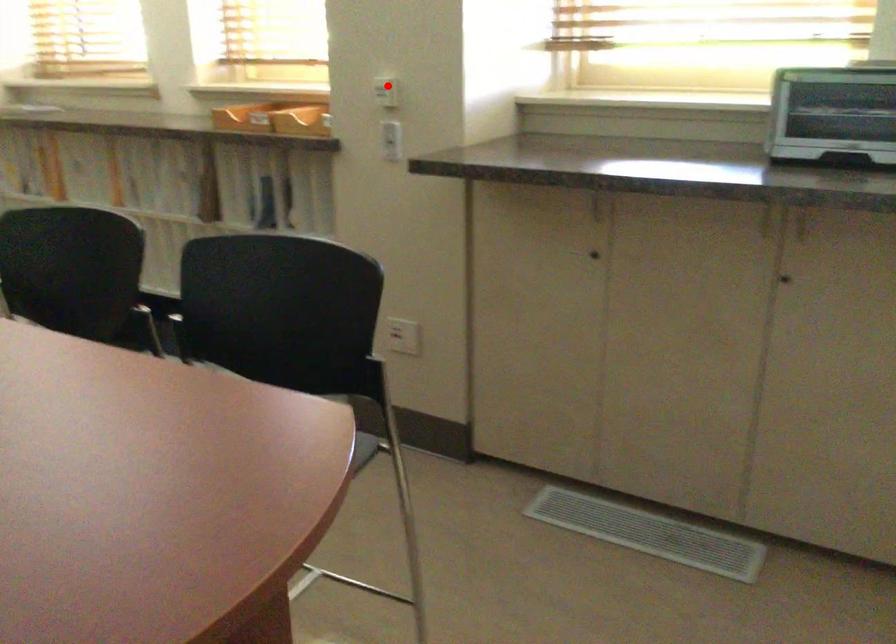
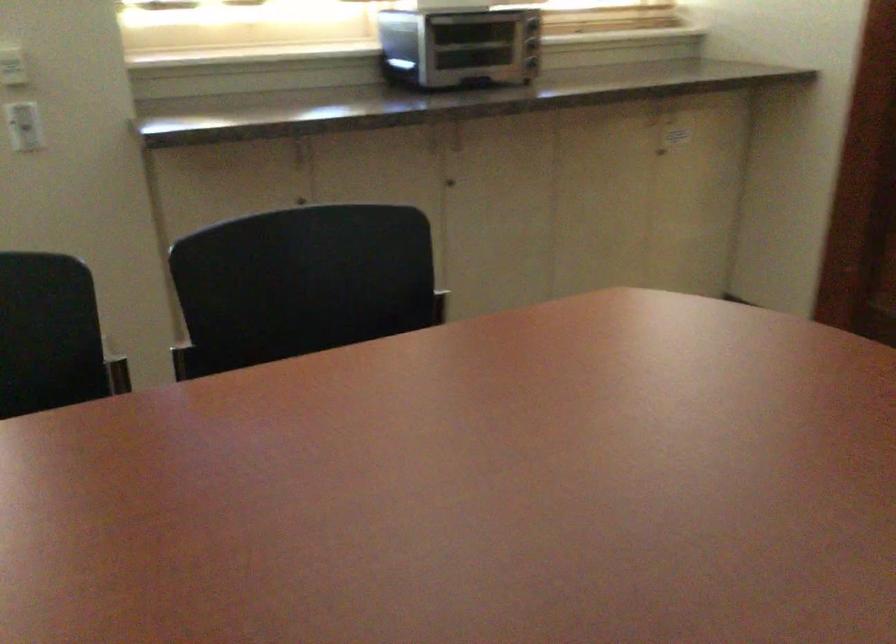
Find the pixel in the second image that matches the highlighted location in the first image.

(11, 62)